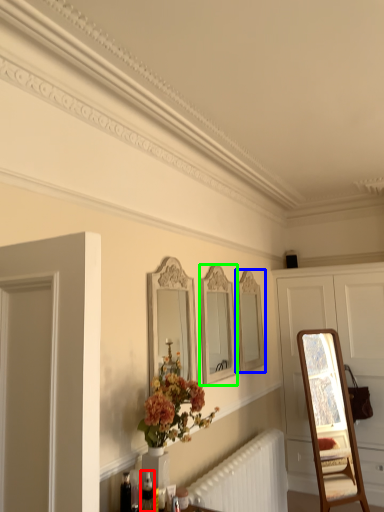
Question: Considering the real-world distances, which object is farthest from toiletry (highlighted by a red box)? mirror (highlighted by a blue box) or mirror (highlighted by a green box)?

Choices:
 (A) mirror
 (B) mirror

Answer: (A)